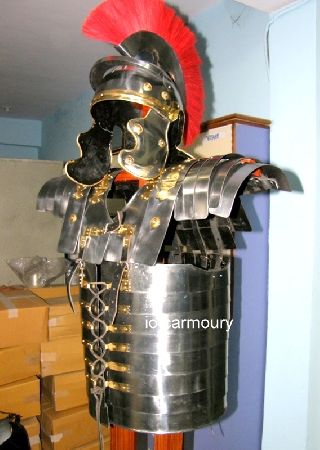
The width and height of the screenshot is (320, 450). Find the location of `display dummy legs`. display dummy legs is located at coordinates (163, 440), (126, 438).